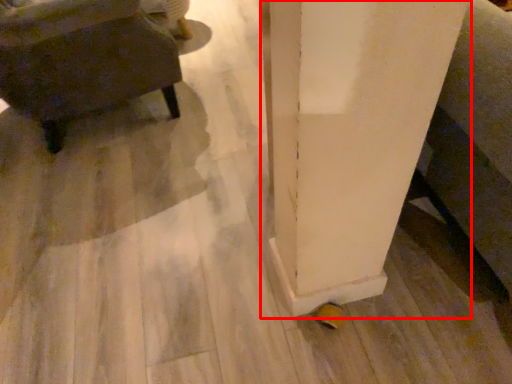
Question: From the image's perspective, where is pillar (annotated by the red box) located relative to furniture?

Choices:
 (A) above
 (B) below

Answer: (B)